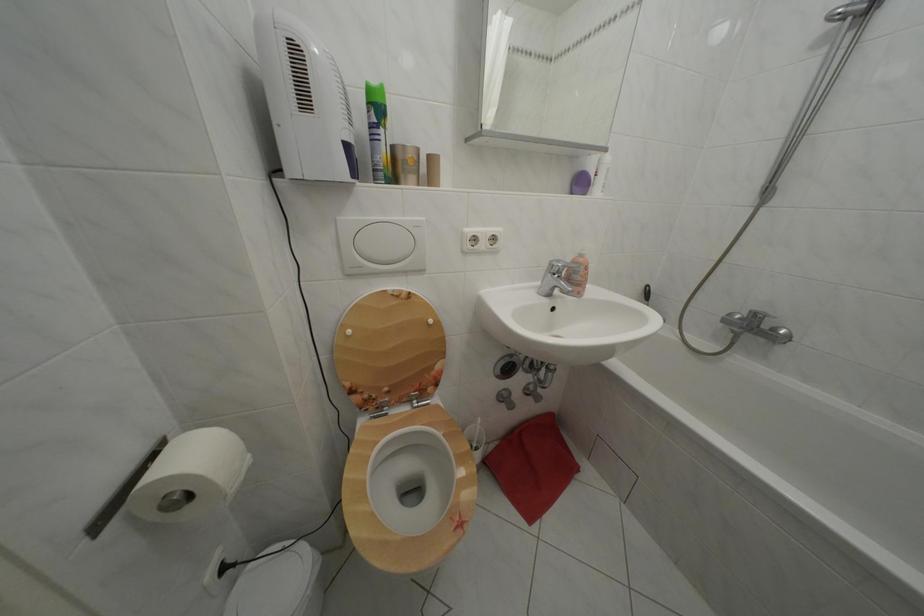
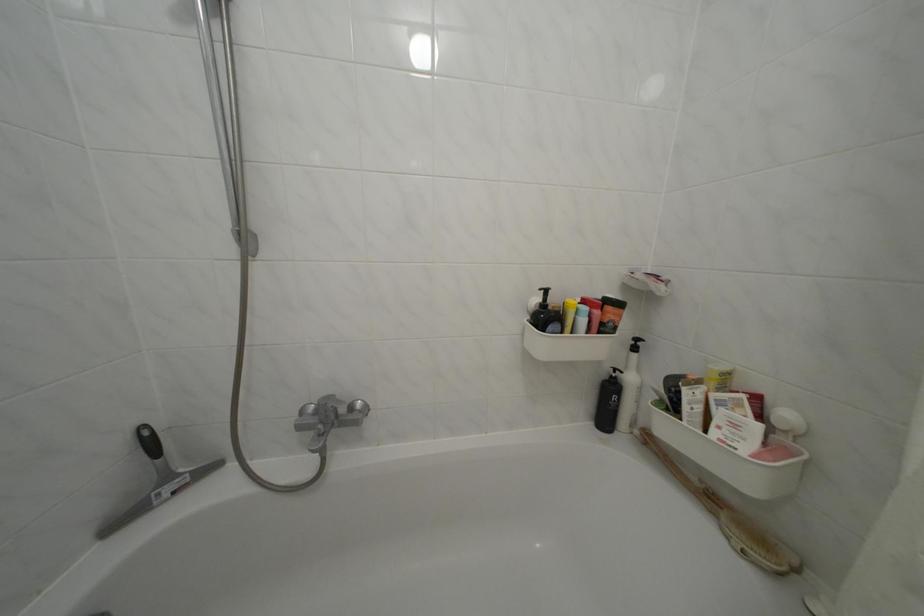
Question: The images are taken continuously from a first-person perspective. In which direction is your viewpoint rotating?

Choices:
 (A) Left
 (B) Right
 (C) Up
 (D) Down

Answer: (B)